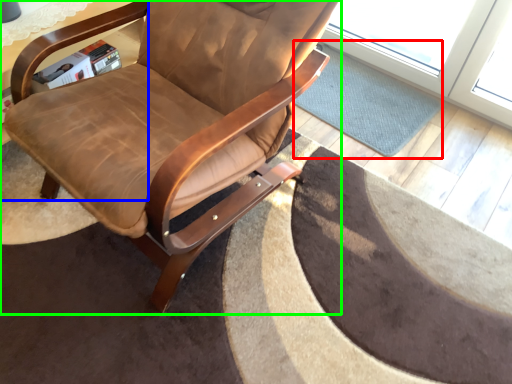
Question: Estimate the real-world distances between objects in this image. Which object is closer to mat (highlighted by a red box), table (highlighted by a blue box) or chair (highlighted by a green box)?

Choices:
 (A) table
 (B) chair

Answer: (B)